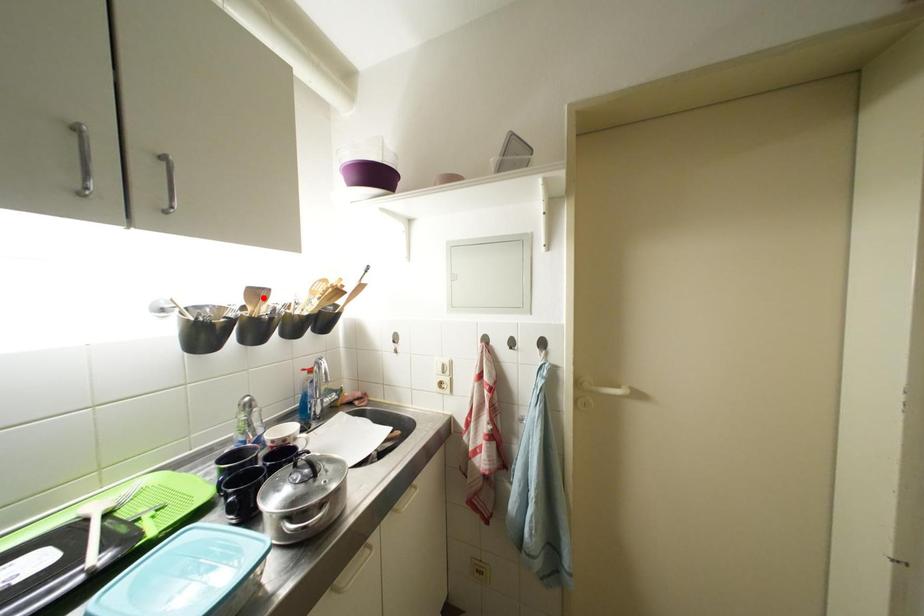
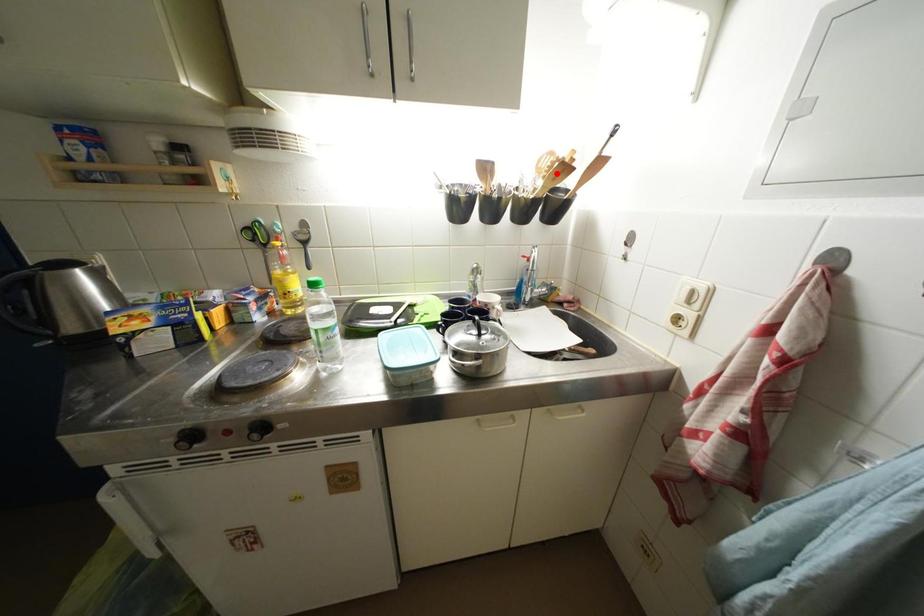
I am providing you with two images of the same scene from different viewpoints. A red point is marked on the first image and another point is marked on the second image. Is the red point in image1 aligned with the point shown in image2?

No